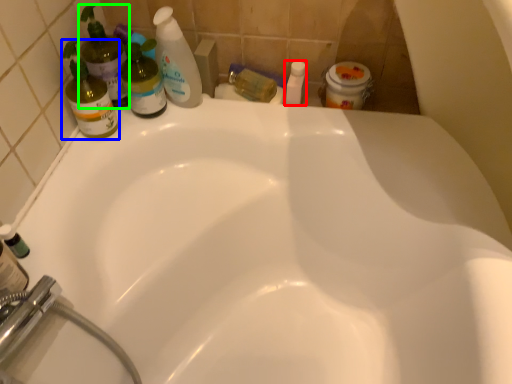
Question: Estimate the real-world distances between objects in this image. Which object is farther from toiletry (highlighted by a red box), cleaning product (highlighted by a blue box) or cleaning product (highlighted by a green box)?

Choices:
 (A) cleaning product
 (B) cleaning product

Answer: (A)